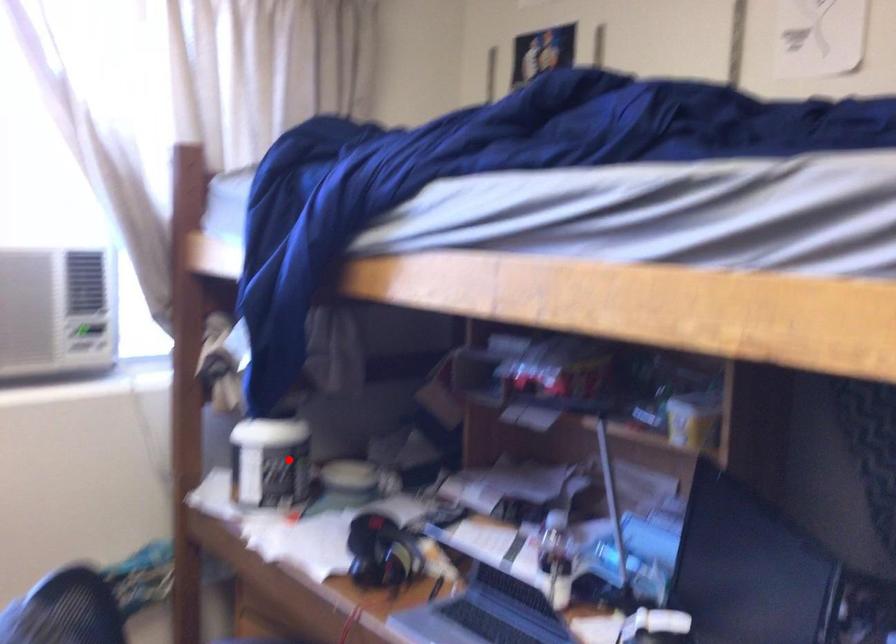
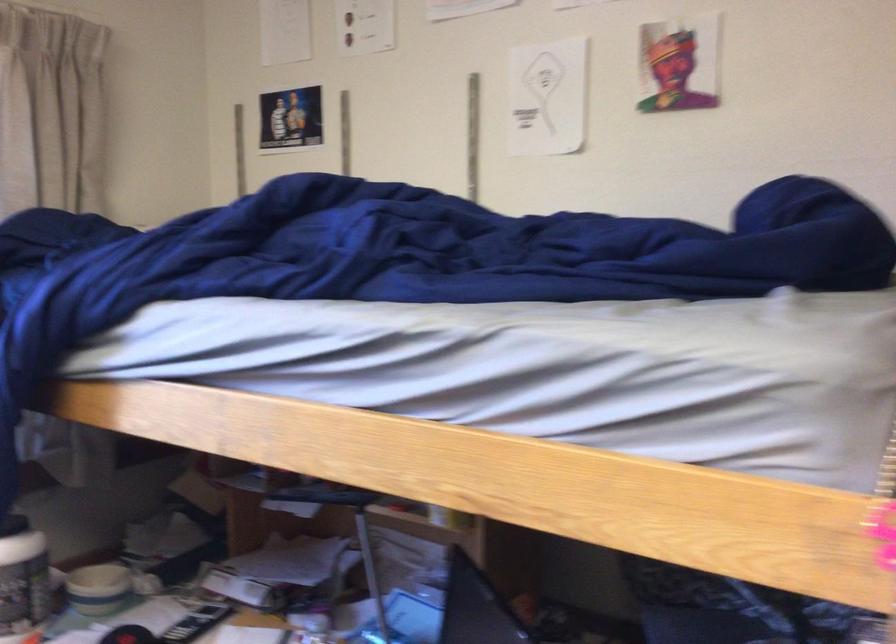
Question: A red point is marked in image1. In image2, is the corresponding 3D point closer to the camera or farther? Reply with the corresponding letter.

Choices:
 (A) The corresponding 3D point is closer.
 (B) The corresponding 3D point is farther.

Answer: (A)